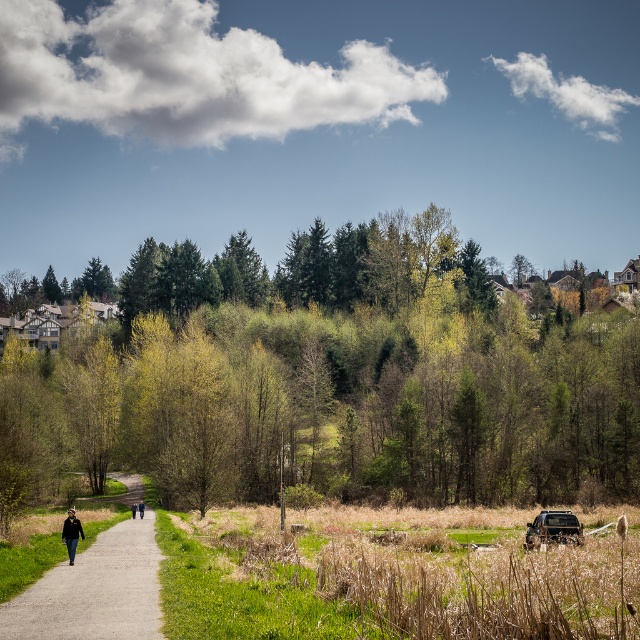
Question: Which point is farther to the camera?

Choices:
 (A) black jacket at center
 (B) green leafy tree at center

Answer: (A)

Question: Can you confirm if dark blue jacket at lower left is positioned to the left of black fabric jacket at center?

Choices:
 (A) no
 (B) yes

Answer: (A)

Question: Where is metallic silver jeep at lower right located in relation to black jacket at center in the image?

Choices:
 (A) above
 (B) below

Answer: (A)

Question: Does black fabric jacket at center appear over black jacket at center?

Choices:
 (A) yes
 (B) no

Answer: (B)

Question: Which of the following is the closest to the observer?

Choices:
 (A) metallic silver jeep at lower right
 (B) green leafy tree at center
 (C) black fabric jacket at center
 (D) gravel path at left

Answer: (D)

Question: Estimate the real-world distances between objects in this image. Which object is farther from the green leafy tree at center?

Choices:
 (A) dark blue jacket at lower left
 (B) black jacket at center
 (C) metallic silver jeep at lower right
 (D) gravel path at left

Answer: (A)